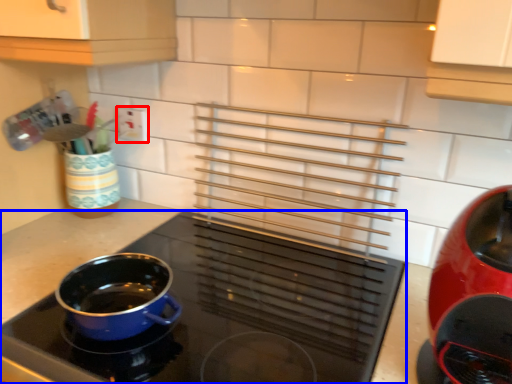
Question: Which point is further to the camera, electric outlet (highlighted by a red box) or kitchen appliance (highlighted by a blue box)?

Choices:
 (A) electric outlet
 (B) kitchen appliance

Answer: (A)